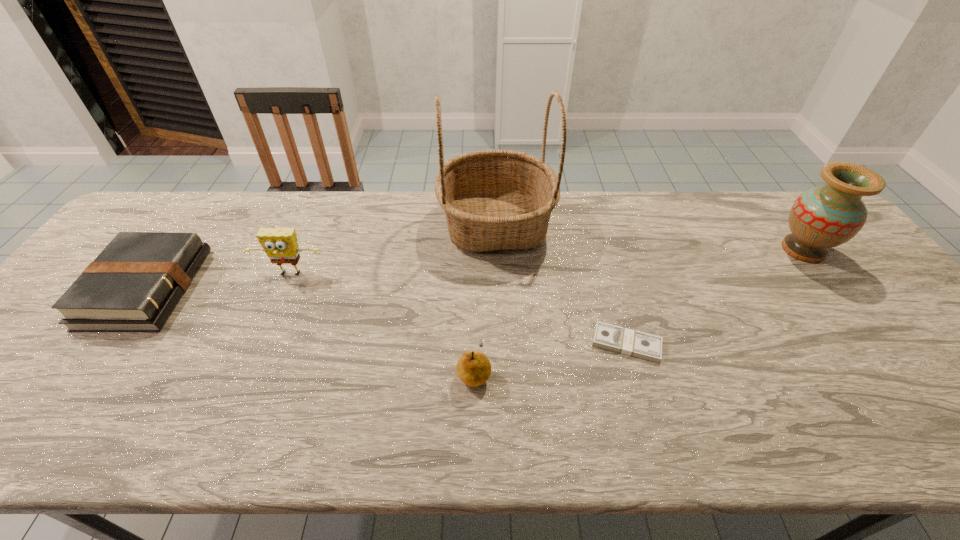
Where is `vacant space located 0.250m on the left of the basket`? vacant space located 0.250m on the left of the basket is located at coordinates (357, 225).

The width and height of the screenshot is (960, 540). I want to click on free region located on the front of the rightmost object, so click(x=887, y=361).

At what (x,y) coordinates should I click in order to perform the action: click on vacant space located 0.390m on the face of the fourth shortest object. Please return your answer as a coordinate pair (x, y). This screenshot has width=960, height=540. Looking at the image, I should click on (231, 420).

This screenshot has width=960, height=540. In order to click on free region located on the right of the pear in this screenshot , I will do `click(579, 372)`.

Find the location of a particular element. This screenshot has height=540, width=960. free space located 0.120m on the spine side of the leftmost object is located at coordinates (235, 288).

Find the location of `vacant space situated 0.230m on the back of the shortest object`. vacant space situated 0.230m on the back of the shortest object is located at coordinates (603, 261).

This screenshot has width=960, height=540. Find the location of `basket that is at the far edge`. basket that is at the far edge is located at coordinates (493, 199).

Locate an element on the screen. The image size is (960, 540). vase at the far edge is located at coordinates (822, 217).

Image resolution: width=960 pixels, height=540 pixels. I want to click on object that is at the left edge, so click(133, 285).

Identify the location of object located in the right edge section of the desktop. Image resolution: width=960 pixels, height=540 pixels. (822, 217).